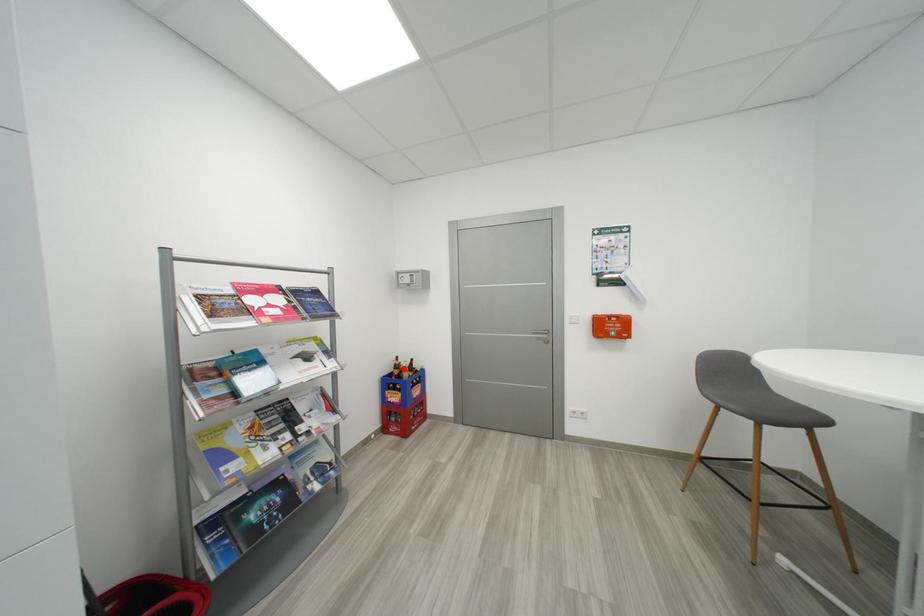
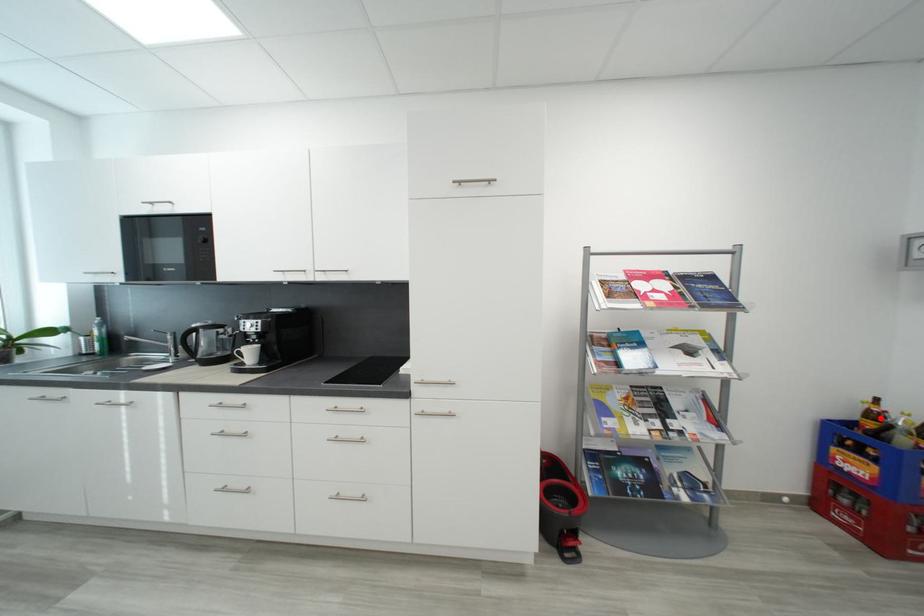
I am providing you with two images of the same scene from different viewpoints. A red point is marked on the first image and another point is marked on the second image. Is the marked point in image1 the same physical position as the marked point in image2?

Yes